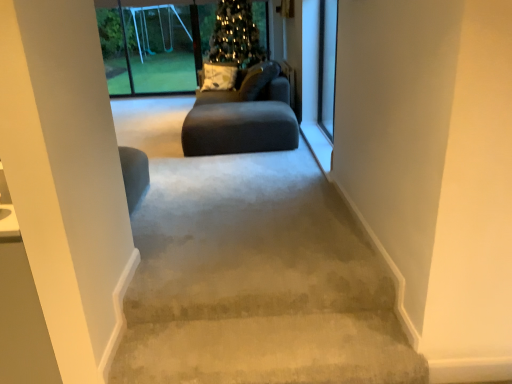
Question: Is the depth of clear glass screen door at upper right, the second screen door in the top-to-bottom sequence, greater than that of matte gray couch at center?

Choices:
 (A) no
 (B) yes

Answer: (A)

Question: Does clear glass screen door at upper right, which appears as the 1th screen door when ordered from the bottom, appear on the left side of matte gray couch at center?

Choices:
 (A) yes
 (B) no

Answer: (B)

Question: From a real-world perspective, is clear glass screen door at upper right, which appears as the 1th screen door when ordered from the bottom, physically above matte gray couch at center?

Choices:
 (A) no
 (B) yes

Answer: (B)

Question: Is matte gray couch at center inside clear glass screen door at upper right, the first screen door from the right?

Choices:
 (A) yes
 (B) no

Answer: (B)

Question: Is clear glass screen door at upper right, the second screen door in the top-to-bottom sequence, wider than matte gray couch at center?

Choices:
 (A) yes
 (B) no

Answer: (B)

Question: Considering the relative sizes of clear glass screen door at upper right, which appears as the 1th screen door when ordered from the bottom, and dark gray fabric couch at center in the image provided, is clear glass screen door at upper right, which appears as the 1th screen door when ordered from the bottom, wider than dark gray fabric couch at center?

Choices:
 (A) yes
 (B) no

Answer: (B)

Question: Is clear glass screen door at upper right, which appears as the 1th screen door when ordered from the bottom, facing towards dark gray fabric couch at center?

Choices:
 (A) yes
 (B) no

Answer: (B)

Question: Does clear glass screen door at upper right, the first screen door from the right, lie behind dark gray fabric couch at center?

Choices:
 (A) yes
 (B) no

Answer: (B)

Question: Does clear glass screen door at upper right, which is the 2th screen door from left to right, come in front of dark gray fabric couch at center?

Choices:
 (A) no
 (B) yes

Answer: (B)

Question: From the image's perspective, does clear glass screen door at upper right, the first screen door from the right, appear lower than dark gray fabric couch at center?

Choices:
 (A) no
 (B) yes

Answer: (B)

Question: Is the surface of clear glass screen door at upper right, the 1th screen door from the front, in direct contact with dark gray fabric couch at center?

Choices:
 (A) no
 (B) yes

Answer: (A)

Question: From a real-world perspective, is matte gray couch at center positioned over transparent plastic swing set at upper left, the first screen door when ordered from left to right, based on gravity?

Choices:
 (A) yes
 (B) no

Answer: (B)